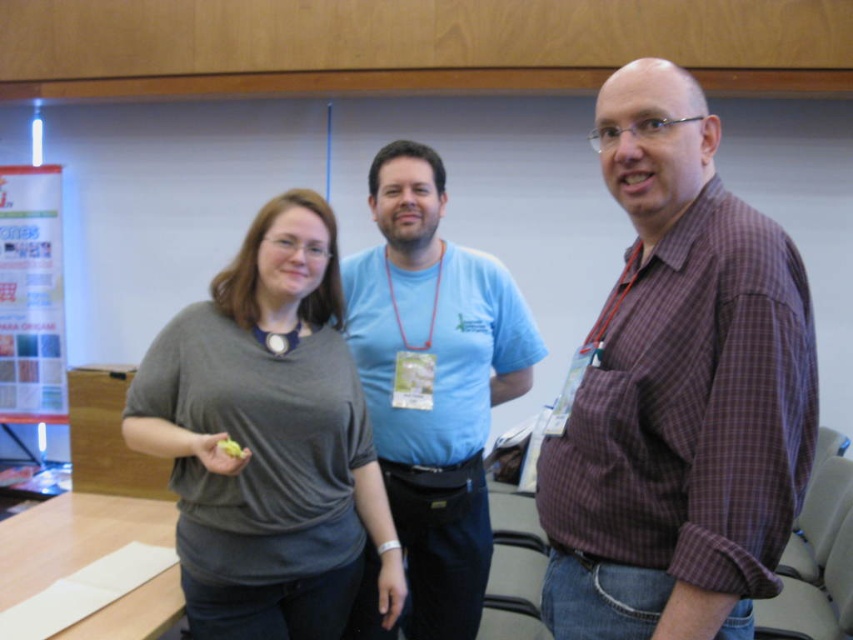
Question: Does purple checkered shirt at right have a smaller size compared to gray matte shirt at center?

Choices:
 (A) no
 (B) yes

Answer: (B)

Question: Which point is closer to the camera?

Choices:
 (A) purple checkered shirt at right
 (B) blue cotton t-shirt at center
 (C) gray matte shirt at center

Answer: (A)

Question: Which point appears farthest from the camera in this image?

Choices:
 (A) (490, 392)
 (B) (253, 522)
 (C) (650, 616)

Answer: (A)

Question: From the image, what is the correct spatial relationship of purple checkered shirt at right in relation to blue cotton t-shirt at center?

Choices:
 (A) above
 (B) below

Answer: (A)

Question: Which point is closer to the camera taking this photo?

Choices:
 (A) (489, 333)
 (B) (627, 515)
 (C) (314, 378)

Answer: (B)

Question: In this image, where is gray matte shirt at center located relative to blue cotton t-shirt at center?

Choices:
 (A) right
 (B) left

Answer: (B)